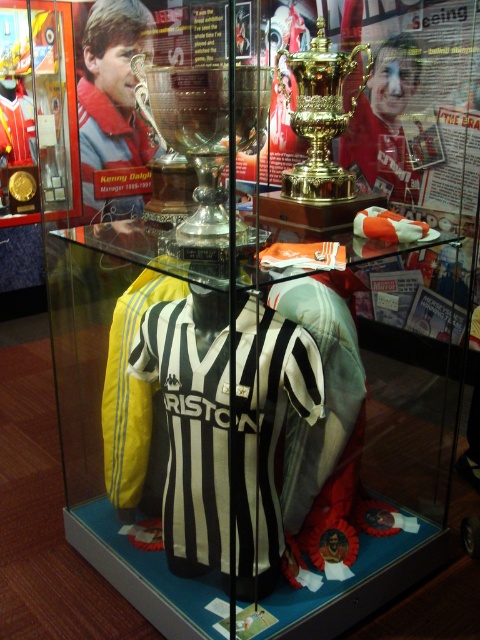
Can you confirm if black and white striped jersey at center is positioned to the right of silver polished trophy at center?

Yes, black and white striped jersey at center is to the right of silver polished trophy at center.

Does black and white striped jersey at center have a lesser width compared to silver polished trophy at center?

No.

Is point (250, 426) farther from camera compared to point (197, 76)?

Yes, it is behind point (197, 76).

Identify the location of black and white striped jersey at center. This screenshot has height=640, width=480. (190, 432).

Is black and white striped jersey at center wider than gold polished trophy at upper center?

Yes, black and white striped jersey at center is wider than gold polished trophy at upper center.

Between black and white striped jersey at center and gold polished trophy at upper center, which one is positioned higher?

gold polished trophy at upper center

Between point (211, 419) and point (344, 113), which one is positioned in front?

Positioned in front is point (211, 419).

The height and width of the screenshot is (640, 480). What are the coordinates of `black and white striped jersey at center` in the screenshot? It's located at (190, 432).

Between silver polished trophy at center and gold polished trophy at upper center, which one is positioned lower?

silver polished trophy at center is lower down.

Describe the element at coordinates (192, 136) in the screenshot. I see `silver polished trophy at center` at that location.

Is point (199, 230) closer to camera compared to point (336, 97)?

That is True.

Identify the location of silver polished trophy at center. This screenshot has width=480, height=640. (192, 136).